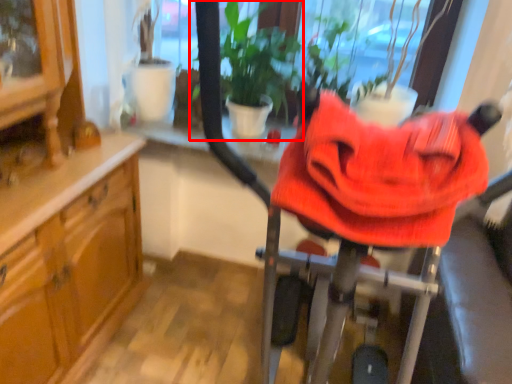
Question: From the image, what is the correct spatial relationship of houseplant (annotated by the red box) in relation to baby carriage?

Choices:
 (A) left
 (B) right

Answer: (A)